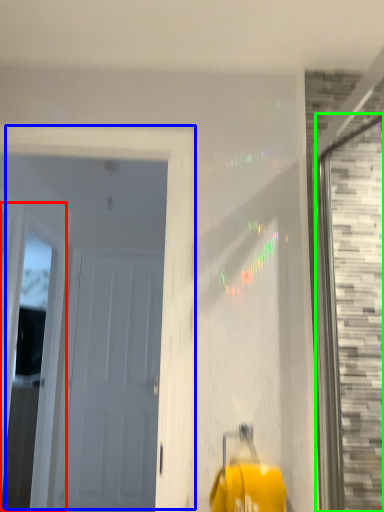
Question: Which is nearer to the window (highlighted by a red box)? door (highlighted by a blue box) or window (highlighted by a green box).

Choices:
 (A) door
 (B) window

Answer: (A)